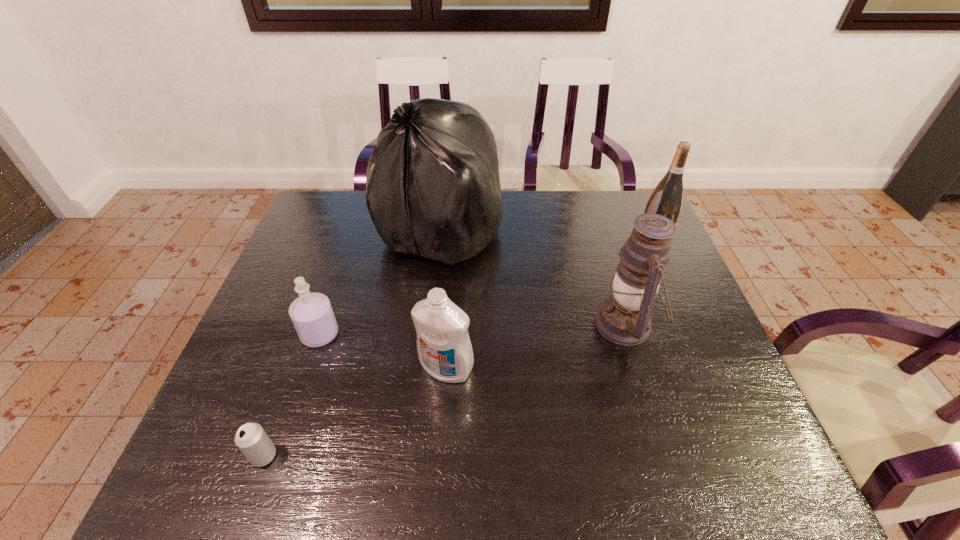
Locate an element on the screen. This screenshot has height=540, width=960. free spot that satisfies the following two spatial constraints: 1. on the label of the rightmost object; 2. on the front side of the third shortest object is located at coordinates (706, 368).